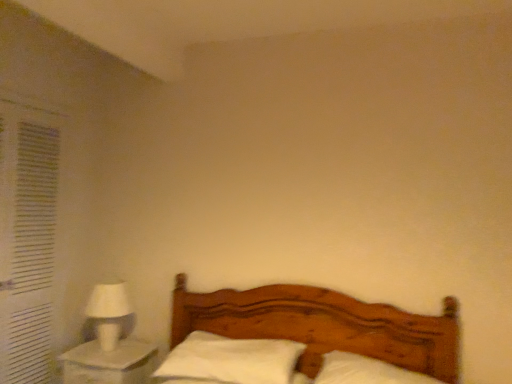
I want to click on white soft pillow at center, placed as the first pillow when sorted from right to left, so click(x=365, y=371).

This screenshot has width=512, height=384. What do you see at coordinates (109, 363) in the screenshot?
I see `white glossy nightstand at lower left` at bounding box center [109, 363].

Measure the distance between point (7, 180) and camera.

Point (7, 180) is 7.08 feet away from camera.

The width and height of the screenshot is (512, 384). Describe the element at coordinates (230, 361) in the screenshot. I see `white soft pillow at center, which ranks as the 2th pillow in right-to-left order` at that location.

The image size is (512, 384). What are the coordinates of `wooden bed at center` in the screenshot? It's located at (330, 314).

Describe the element at coordinates (330, 314) in the screenshot. I see `wooden bed at center` at that location.

This screenshot has width=512, height=384. I want to click on white soft pillow at center, placed as the first pillow when sorted from right to left, so click(x=365, y=371).

Based on the photo, from the image's perspective, which one is positioned lower, white glossy nightstand at lower left or white fabric curtain at left?

white glossy nightstand at lower left, from the image's perspective.

Is white glossy nightstand at lower left facing away from white fabric curtain at left?

No, white fabric curtain at left is not at the back of white glossy nightstand at lower left.

Considering the sizes of objects white glossy nightstand at lower left and white fabric curtain at left in the image provided, who is shorter, white glossy nightstand at lower left or white fabric curtain at left?

white glossy nightstand at lower left is shorter.

Is point (128, 295) positioned before point (38, 337)?

No, it is behind (38, 337).

Is white fabric curtain at left located within white matte table lamp at left?

No.

From a real-world perspective, which is physically above, white matte table lamp at left or white fabric curtain at left?

white fabric curtain at left, from a real-world perspective.

Considering the relative sizes of white matte table lamp at left and white fabric curtain at left in the image provided, is white matte table lamp at left thinner than white fabric curtain at left?

No, white matte table lamp at left is not thinner than white fabric curtain at left.

Which object is closer to the camera taking this photo, white fabric curtain at left or white soft pillow at center, the first pillow from the left?

white soft pillow at center, the first pillow from the left, is more forward.

Considering the points (29, 360) and (180, 355), which point is behind, point (29, 360) or point (180, 355)?

Positioned behind is point (29, 360).

In the scene shown: Who is shorter, white fabric curtain at left or white soft pillow at center, the first pillow from the left?

With less height is white soft pillow at center, the first pillow from the left.

In the scene shown: Which of these two, white fabric curtain at left or white soft pillow at center, which ranks as the 2th pillow in right-to-left order, is smaller?

With smaller size is white fabric curtain at left.

Locate an element on the screen. pillow that is the 1st object located above the white glossy nightstand at lower left (from the image's perspective) is located at coordinates (365, 371).

From a real-world perspective, who is located lower, white glossy nightstand at lower left or white soft pillow at center, acting as the 2th pillow starting from the left?

In real-world perspective, white glossy nightstand at lower left is lower.

Is white glossy nightstand at lower left touching white soft pillow at center, acting as the 2th pillow starting from the left?

No, white glossy nightstand at lower left is not with white soft pillow at center, acting as the 2th pillow starting from the left.

Does white glossy nightstand at lower left appear on the left side of white soft pillow at center, acting as the 2th pillow starting from the left?

Yes, white glossy nightstand at lower left is to the left of white soft pillow at center, acting as the 2th pillow starting from the left.

Measure the distance between white matte table lamp at left and white soft pillow at center, which ranks as the 2th pillow in right-to-left order.

A distance of 24.62 inches exists between white matte table lamp at left and white soft pillow at center, which ranks as the 2th pillow in right-to-left order.

Considering the positions of objects white matte table lamp at left and white soft pillow at center, which ranks as the 2th pillow in right-to-left order, in the image provided, who is more to the right, white matte table lamp at left or white soft pillow at center, which ranks as the 2th pillow in right-to-left order,?

white soft pillow at center, which ranks as the 2th pillow in right-to-left order.

Is white matte table lamp at left wider or thinner than white soft pillow at center, the first pillow from the left?

Considering their sizes, white matte table lamp at left looks slimmer than white soft pillow at center, the first pillow from the left.

Do you think white matte table lamp at left is within white soft pillow at center, which ranks as the 2th pillow in right-to-left order, or outside of it?

white matte table lamp at left is not enclosed by white soft pillow at center, which ranks as the 2th pillow in right-to-left order.

Where is `curtain above the wooden bed at center (from the image's perspective)`? The image size is (512, 384). curtain above the wooden bed at center (from the image's perspective) is located at coordinates (30, 258).

Is wooden bed at center not within white fabric curtain at left?

Yes, wooden bed at center is outside of white fabric curtain at left.

Which of these two, wooden bed at center or white fabric curtain at left, stands taller?

With more height is white fabric curtain at left.

Is wooden bed at center far away from white fabric curtain at left?

Yes, wooden bed at center is far from white fabric curtain at left.

Does point (353, 346) appear closer or farther from the camera than point (191, 343)?

Clearly, point (353, 346) is closer to the camera than point (191, 343).

Is wooden bed at center facing towards white soft pillow at center, the first pillow from the left?

No, wooden bed at center is not turned towards white soft pillow at center, the first pillow from the left.

Is wooden bed at center not close to white soft pillow at center, which ranks as the 2th pillow in right-to-left order?

They are positioned close to each other.

Where is `curtain above the white glossy nightstand at lower left (from the image's perspective)`? The image size is (512, 384). curtain above the white glossy nightstand at lower left (from the image's perspective) is located at coordinates (30, 258).

The image size is (512, 384). What are the coordinates of `table lamp that is on the right side of white fabric curtain at left` in the screenshot? It's located at (109, 313).

Looking at the image, which one is located closer to white soft pillow at center, which ranks as the 2th pillow in right-to-left order, white soft pillow at center, acting as the 2th pillow starting from the left, or wooden bed at center?

wooden bed at center is closer to white soft pillow at center, which ranks as the 2th pillow in right-to-left order.

Which object lies further to the anchor point white matte table lamp at left, white soft pillow at center, which ranks as the 2th pillow in right-to-left order, or white fabric curtain at left?

white soft pillow at center, which ranks as the 2th pillow in right-to-left order, lies further to white matte table lamp at left than the other object.

Consider the image. Based on their spatial positions, is white soft pillow at center, acting as the 2th pillow starting from the left, or white soft pillow at center, which ranks as the 2th pillow in right-to-left order, further from white glossy nightstand at lower left?

Among the two, white soft pillow at center, acting as the 2th pillow starting from the left, is located further to white glossy nightstand at lower left.

From the image, which object appears to be farther from wooden bed at center, white fabric curtain at left or white glossy nightstand at lower left?

Among the two, white fabric curtain at left is located further to wooden bed at center.

When comparing their distances from white glossy nightstand at lower left, does wooden bed at center or white matte table lamp at left seem closer?

white matte table lamp at left lies closer to white glossy nightstand at lower left than the other object.

Based on their spatial positions, is wooden bed at center or white soft pillow at center, acting as the 2th pillow starting from the left, further from white fabric curtain at left?

Based on the image, white soft pillow at center, acting as the 2th pillow starting from the left, appears to be further to white fabric curtain at left.

In the scene shown: Which object lies further to the anchor point white soft pillow at center, the first pillow from the left, white matte table lamp at left or white soft pillow at center, placed as the first pillow when sorted from right to left?

Among the two, white matte table lamp at left is located further to white soft pillow at center, the first pillow from the left.

Looking at the image, which one is located closer to white soft pillow at center, the first pillow from the left, white glossy nightstand at lower left or white matte table lamp at left?

white glossy nightstand at lower left.

Find the location of a particular element. nightstand between wooden bed at center and white fabric curtain at left from front to back is located at coordinates (109, 363).

Identify the location of pillow located between wooden bed at center and white soft pillow at center, the first pillow from the left, in the depth direction. This screenshot has height=384, width=512. (365, 371).

You are a GUI agent. You are given a task and a screenshot of the screen. Output one action in this format:
    pyautogui.click(x=<x>, y=<y>)
    Task: Click on the nightstand situated between white matte table lamp at left and white soft pillow at center, placed as the first pillow when sorted from right to left, from left to right
    The image size is (512, 384).
    Given the screenshot: What is the action you would take?
    pyautogui.click(x=109, y=363)

You are a GUI agent. You are given a task and a screenshot of the screen. Output one action in this format:
    pyautogui.click(x=<x>, y=<y>)
    Task: Click on the pillow between white matte table lamp at left and white soft pillow at center, acting as the 2th pillow starting from the left
    This screenshot has height=384, width=512.
    Given the screenshot: What is the action you would take?
    pyautogui.click(x=230, y=361)